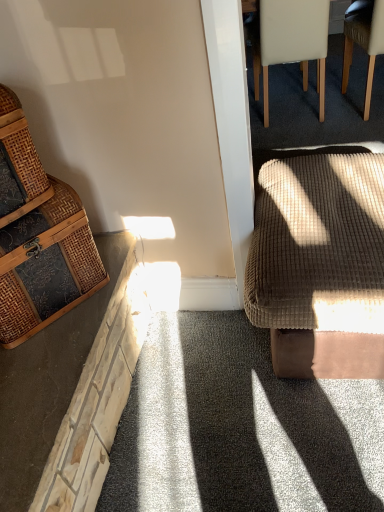
This screenshot has height=512, width=384. Describe the element at coordinates (319, 264) in the screenshot. I see `velvet brown footstool at right` at that location.

Describe the element at coordinates (290, 42) in the screenshot. I see `white leather chair at upper right, which is the 1th chair in top-to-bottom order` at that location.

The width and height of the screenshot is (384, 512). Find the location of `velvet brown footstool at right`. velvet brown footstool at right is located at coordinates (319, 264).

From the image's perspective, is brown fabric chair at upper right, the 2th chair when ordered from front to back, on top of velvet brown footstool at right?

Yes, from the image's perspective, brown fabric chair at upper right, the 2th chair when ordered from front to back, is over velvet brown footstool at right.

Is point (368, 34) behind point (346, 251)?

Yes.

From a real-world perspective, is brown fabric chair at upper right, the 2th chair when ordered from back to front, beneath velvet brown footstool at right?

Incorrect, from a real-world perspective, brown fabric chair at upper right, the 2th chair when ordered from back to front, is higher than velvet brown footstool at right.

Does point (352, 212) appear closer or farther from the camera than point (361, 29)?

Point (352, 212) is closer to the camera than point (361, 29).

Considering the relative sizes of velvet brown footstool at right and brown fabric chair at upper right, which is the first chair in right-to-left order, in the image provided, is velvet brown footstool at right smaller than brown fabric chair at upper right, which is the first chair in right-to-left order,?

Actually, velvet brown footstool at right might be larger than brown fabric chair at upper right, which is the first chair in right-to-left order.

Considering the relative positions of velvet brown footstool at right and brown fabric chair at upper right, which is the 2th chair in top-to-bottom order, in the image provided, is velvet brown footstool at right to the right of brown fabric chair at upper right, which is the 2th chair in top-to-bottom order, from the viewer's perspective?

No, velvet brown footstool at right is not to the right of brown fabric chair at upper right, which is the 2th chair in top-to-bottom order.

From the image's perspective, is velvet brown footstool at right on brown fabric chair at upper right, which is the 2th chair in top-to-bottom order?

No.

From the image's perspective, is woven brown basket at left positioned above or below white leather chair at upper right, which is counted as the second chair, starting from the right?

woven brown basket at left is below white leather chair at upper right, which is counted as the second chair, starting from the right.

Is woven brown basket at left far from white leather chair at upper right, the third chair ordered from the bottom?

Yes.

Considering the positions of point (12, 172) and point (287, 22), is point (12, 172) closer or farther from the camera than point (287, 22)?

Point (12, 172) is closer to the camera than point (287, 22).

Considering the relative positions of woven brown basket at left and white leather chair at upper right, acting as the 3th chair starting from the front, in the image provided, is woven brown basket at left to the left of white leather chair at upper right, acting as the 3th chair starting from the front, from the viewer's perspective?

Correct, you'll find woven brown basket at left to the left of white leather chair at upper right, acting as the 3th chair starting from the front.

The image size is (384, 512). I want to click on chair below the white leather chair at upper right, which is the second chair in left-to-right order (from a real-world perspective), so click(364, 44).

Is brown fabric chair at upper right, which is the first chair in right-to-left order, inside the boundaries of white leather chair at upper right, acting as the 3th chair starting from the front, or outside?

The correct answer is: outside.

From the image's perspective, is brown fabric chair at upper right, arranged as the third chair when viewed from the left, above or below white leather chair at upper right, the third chair ordered from the bottom?

brown fabric chair at upper right, arranged as the third chair when viewed from the left, is situated lower than white leather chair at upper right, the third chair ordered from the bottom, in the image.

From a real-world perspective, is velvet brown footstool at right positioned above or below woven brown basket at left?

velvet brown footstool at right is situated lower than woven brown basket at left in the real world.

This screenshot has height=512, width=384. In order to click on basket that appears above the velvet brown footstool at right (from the image's perspective) in this screenshot , I will do `click(18, 163)`.

Considering the relative positions of velvet brown footstool at right and woven brown basket at left in the image provided, is velvet brown footstool at right to the left of woven brown basket at left from the viewer's perspective?

In fact, velvet brown footstool at right is to the right of woven brown basket at left.

Is the depth of white leather chair at upper right, which is the second chair in left-to-right order, less than that of velvet brown footstool at right?

That is False.

Does point (268, 99) come closer to viewer compared to point (332, 237)?

That is False.

What's the angular difference between white leather chair at upper right, which is counted as the second chair, starting from the right, and velvet brown footstool at right's facing directions?

white leather chair at upper right, which is counted as the second chair, starting from the right, and velvet brown footstool at right are facing 94 degrees away from each other.

In order to click on rocking chair below the white leather chair at upper right, acting as the 3th chair starting from the front (from a real-world perspective) in this screenshot , I will do `click(319, 264)`.

Can you confirm if woven rattan chest at left, acting as the 3th chair starting from the back, is shorter than white leather chair at upper right, acting as the 3th chair starting from the front?

Yes, woven rattan chest at left, acting as the 3th chair starting from the back, is shorter than white leather chair at upper right, acting as the 3th chair starting from the front.

The image size is (384, 512). In order to click on chair on the left of white leather chair at upper right, which is counted as the second chair, starting from the right in this screenshot , I will do `click(38, 236)`.

In terms of width, does woven rattan chest at left, the third chair positioned from the top, look wider or thinner when compared to white leather chair at upper right, which is the second chair in left-to-right order?

woven rattan chest at left, the third chair positioned from the top, is thinner than white leather chair at upper right, which is the second chair in left-to-right order.

The image size is (384, 512). I want to click on rocking chair in front of the brown fabric chair at upper right, arranged as the third chair when viewed from the left, so click(x=319, y=264).

At what (x,y) coordinates should I click in order to perform the action: click on rocking chair directly beneath the brown fabric chair at upper right, the 2th chair when ordered from front to back (from a real-world perspective). Please return your answer as a coordinate pair (x, y). Image resolution: width=384 pixels, height=512 pixels. Looking at the image, I should click on (319, 264).

Based on their spatial positions, is woven brown basket at left or woven rattan chest at left, acting as the third chair starting from the right, closer to white leather chair at upper right, which is the second chair in left-to-right order?

woven rattan chest at left, acting as the third chair starting from the right, lies closer to white leather chair at upper right, which is the second chair in left-to-right order, than the other object.

Based on their spatial positions, is white leather chair at upper right, which is counted as the second chair, starting from the right, or velvet brown footstool at right closer to woven rattan chest at left, the first chair when ordered from front to back?

Based on the image, velvet brown footstool at right appears to be nearer to woven rattan chest at left, the first chair when ordered from front to back.

Which object lies further to the anchor point woven brown basket at left, velvet brown footstool at right or woven rattan chest at left, acting as the 3th chair starting from the back?

Based on the image, velvet brown footstool at right appears to be further to woven brown basket at left.

Considering their positions, is woven rattan chest at left, the first chair when ordered from front to back, positioned further to velvet brown footstool at right than brown fabric chair at upper right, the 2th chair when ordered from front to back?

Based on the image, brown fabric chair at upper right, the 2th chair when ordered from front to back, appears to be further to velvet brown footstool at right.

Considering their positions, is woven rattan chest at left, the first chair when ordered from front to back, positioned further to white leather chair at upper right, which is the 1th chair in top-to-bottom order, than brown fabric chair at upper right, which is the 2th chair in top-to-bottom order?

woven rattan chest at left, the first chair when ordered from front to back, lies further to white leather chair at upper right, which is the 1th chair in top-to-bottom order, than the other object.

Which object lies further to the anchor point woven brown basket at left, brown fabric chair at upper right, which is the first chair in right-to-left order, or woven rattan chest at left, which ranks as the 1th chair in bottom-to-top order?

Based on the image, brown fabric chair at upper right, which is the first chair in right-to-left order, appears to be further to woven brown basket at left.

Based on their spatial positions, is velvet brown footstool at right or woven brown basket at left closer to woven rattan chest at left, the third chair positioned from the top?

woven brown basket at left is closer to woven rattan chest at left, the third chair positioned from the top.

Considering their positions, is white leather chair at upper right, the third chair ordered from the bottom, positioned closer to woven brown basket at left than brown fabric chair at upper right, which is the 2th chair in top-to-bottom order?

white leather chair at upper right, the third chair ordered from the bottom, lies closer to woven brown basket at left than the other object.

Find the location of a particular element. Image resolution: width=384 pixels, height=512 pixels. rocking chair between woven rattan chest at left, which ranks as the 1th chair in left-to-right order, and brown fabric chair at upper right, the 2th chair when ordered from front to back, in the horizontal direction is located at coordinates (319, 264).

The height and width of the screenshot is (512, 384). Find the location of `rocking chair between woven brown basket at left and white leather chair at upper right, the third chair ordered from the bottom, in the front-back direction`. rocking chair between woven brown basket at left and white leather chair at upper right, the third chair ordered from the bottom, in the front-back direction is located at coordinates (319, 264).

Identify the location of chair between white leather chair at upper right, which is counted as the second chair, starting from the right, and velvet brown footstool at right, in the vertical direction. (364, 44).

What are the coordinates of `chair between woven rattan chest at left, acting as the 3th chair starting from the back, and brown fabric chair at upper right, which is the first chair in right-to-left order, from left to right` in the screenshot? It's located at (290, 42).